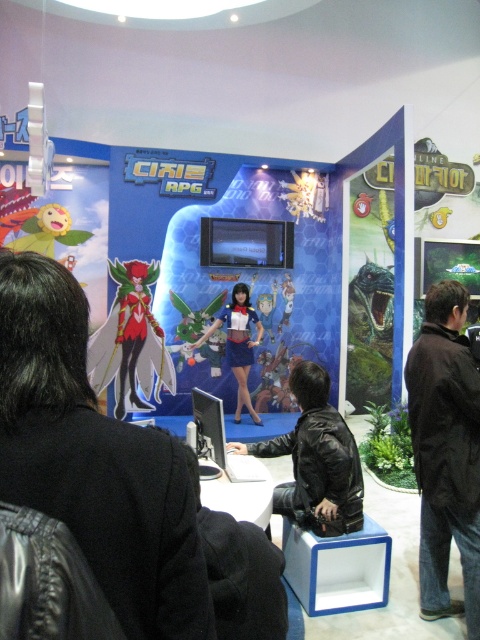
Question: Which of the following is the farthest from the observer?

Choices:
 (A) (227, 360)
 (B) (321, 504)
 (C) (442, 452)

Answer: (A)

Question: Is black leather jacket at right bigger than shiny metallic figure at center?

Choices:
 (A) no
 (B) yes

Answer: (A)

Question: Which point is farther to the camera?

Choices:
 (A) black leather jacket at right
 (B) black leather jacket at center

Answer: (B)

Question: Among these objects, which one is farthest from the camera?

Choices:
 (A) black leather jacket at center
 (B) satin blue dress at center

Answer: (B)

Question: Can you confirm if black leather jacket at right is positioned to the left of shiny metallic figure at center?

Choices:
 (A) yes
 (B) no

Answer: (B)

Question: Is black leather jacket at right below black leather jacket at center?

Choices:
 (A) no
 (B) yes

Answer: (A)